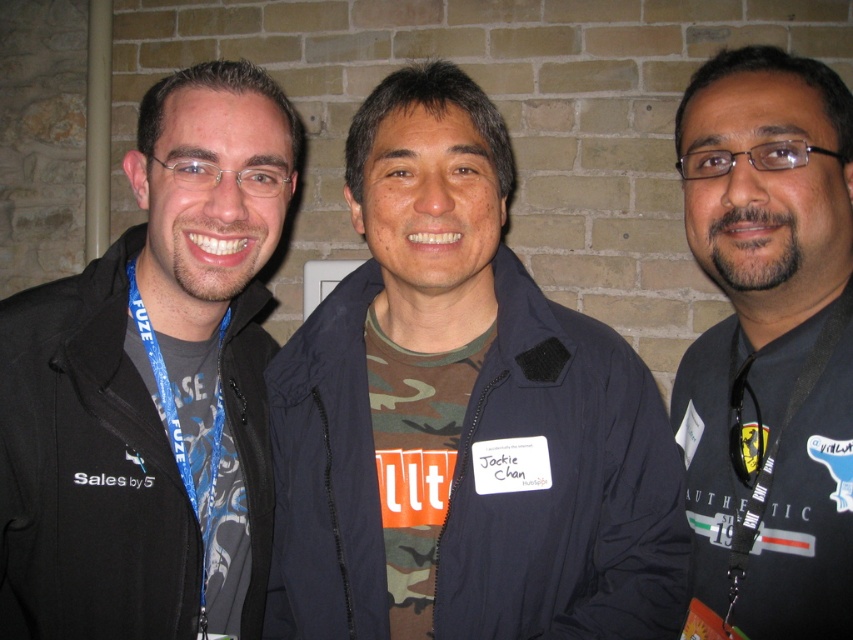
Question: Considering the real-world distances, which object is farthest from the black fabric lanyard at right?

Choices:
 (A) black fabric shirt at center
 (B) camo fabric shirt at center

Answer: (B)

Question: Among these objects, which one is nearest to the camera?

Choices:
 (A) black fabric shirt at center
 (B) black fabric lanyard at right
 (C) black matte jacket at left

Answer: (A)

Question: Can you confirm if black fabric shirt at center is positioned above black fabric lanyard at right?

Choices:
 (A) no
 (B) yes

Answer: (B)

Question: Is camo fabric shirt at center to the right of black matte jacket at left from the viewer's perspective?

Choices:
 (A) no
 (B) yes

Answer: (B)

Question: Which point is farther to the camera?

Choices:
 (A) (189, 428)
 (B) (685, 424)
 (C) (785, 412)

Answer: (B)

Question: Can you confirm if black matte jacket at left is positioned to the right of black fabric shirt at center?

Choices:
 (A) no
 (B) yes

Answer: (A)